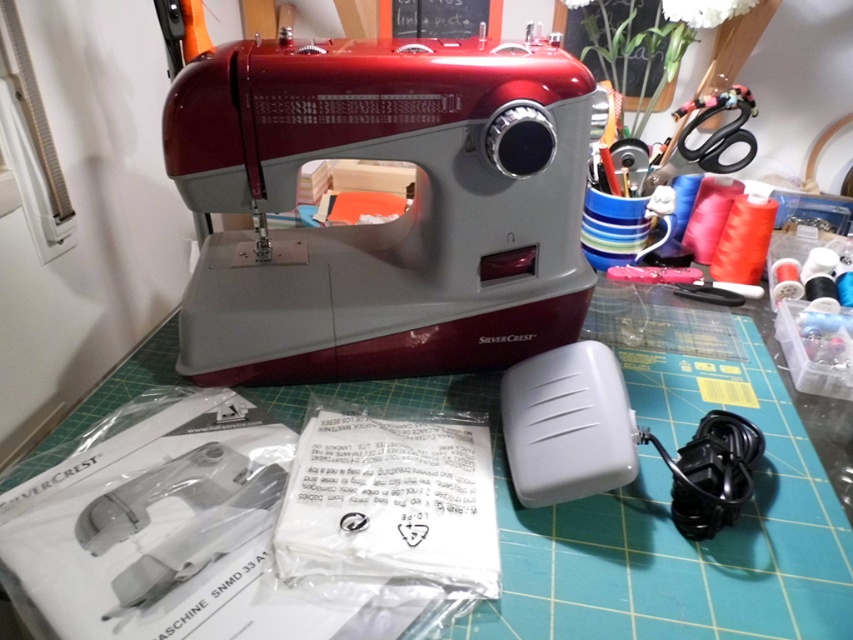
Question: Among these objects, which one is farthest from the camera?

Choices:
 (A) metallic silver scissors at upper right
 (B) matte red sewing machine at center

Answer: (A)

Question: Is matte red sewing machine at center closer to the viewer compared to metallic silver scissors at upper right?

Choices:
 (A) no
 (B) yes

Answer: (B)

Question: Which of the following is the closest to the observer?

Choices:
 (A) metallic silver scissors at upper right
 (B) matte red sewing machine at center

Answer: (B)

Question: Does matte red sewing machine at center have a greater width compared to metallic silver scissors at upper right?

Choices:
 (A) no
 (B) yes

Answer: (B)

Question: Is matte red sewing machine at center wider than metallic silver scissors at upper right?

Choices:
 (A) no
 (B) yes

Answer: (B)